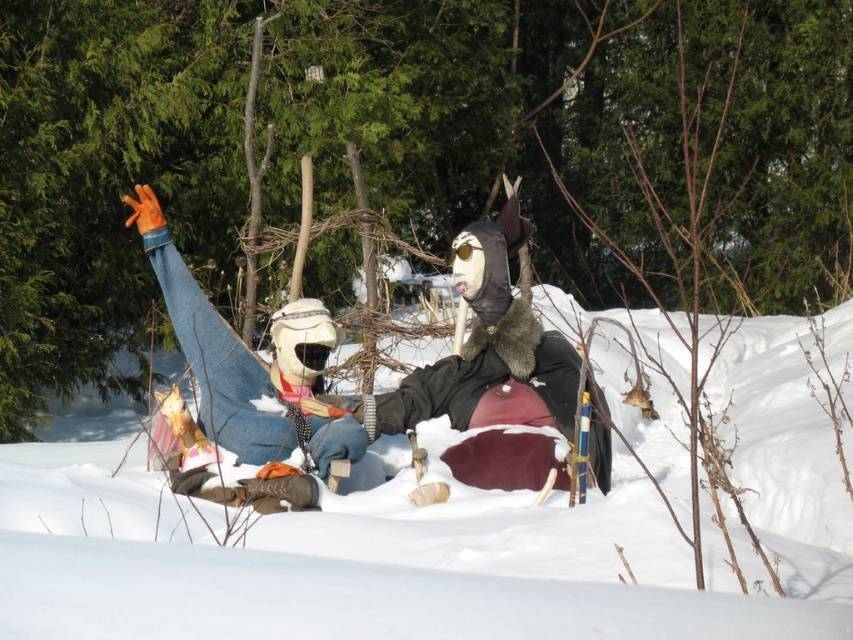
Question: Which of the following is the farthest from the observer?

Choices:
 (A) tap(613, 388)
 (B) tap(283, 346)

Answer: (A)

Question: Can you confirm if white fluffy snow at center is positioned below denim jeans at left?

Choices:
 (A) yes
 (B) no

Answer: (A)

Question: In this image, where is white fluffy snow at center located relative to denim jeans at left?

Choices:
 (A) right
 (B) left

Answer: (A)

Question: Is white fluffy snow at center above denim jeans at left?

Choices:
 (A) no
 (B) yes

Answer: (A)

Question: Which point is farther from the camera taking this photo?

Choices:
 (A) (781, 483)
 (B) (256, 401)

Answer: (A)

Question: Which object appears closest to the camera in this image?

Choices:
 (A) denim jeans at left
 (B) white fluffy snow at center

Answer: (B)